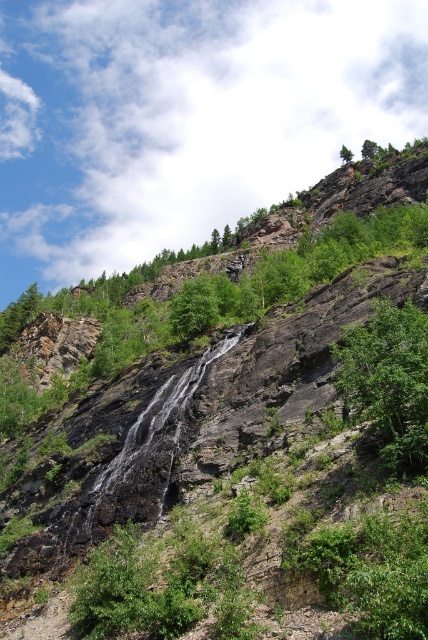
Which is below, green leafy tree at upper center or green leafy tree at upper right?

green leafy tree at upper center

Between point (374, 150) and point (345, 161), which one is positioned in front?

Positioned in front is point (374, 150).

Is point (371, 157) closer to camera compared to point (351, 154)?

Yes, point (371, 157) is in front of point (351, 154).

This screenshot has height=640, width=428. Find the location of `green leafy tree at upper center`. green leafy tree at upper center is located at coordinates (369, 148).

Does green leafy tree at center-right have a larger size compared to green leafy tree at upper right?

Yes.

What are the coordinates of `green leafy tree at center-right` in the screenshot? It's located at (389, 381).

Which of these two, green leafy tree at center-right or green leafy tree at upper center, stands taller?

green leafy tree at center-right

Is green leafy tree at center-right further to the viewer compared to green leafy tree at upper center?

No, it is in front of green leafy tree at upper center.

Who is more forward, (383, 312) or (371, 156)?

Point (383, 312)

Where is `green leafy tree at center-right`? This screenshot has width=428, height=640. green leafy tree at center-right is located at coordinates (389, 381).